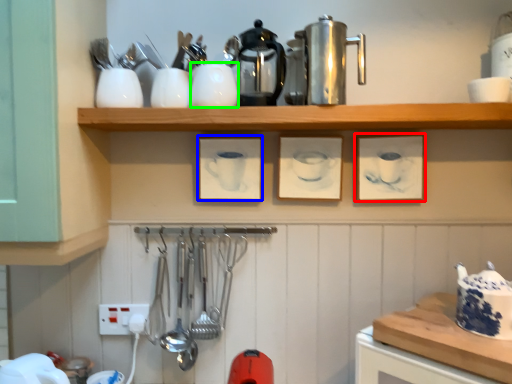
Question: Which is nearer to the picture frame (highlighted by a red box)? picture frame (highlighted by a blue box) or tableware (highlighted by a green box).

Choices:
 (A) picture frame
 (B) tableware

Answer: (A)